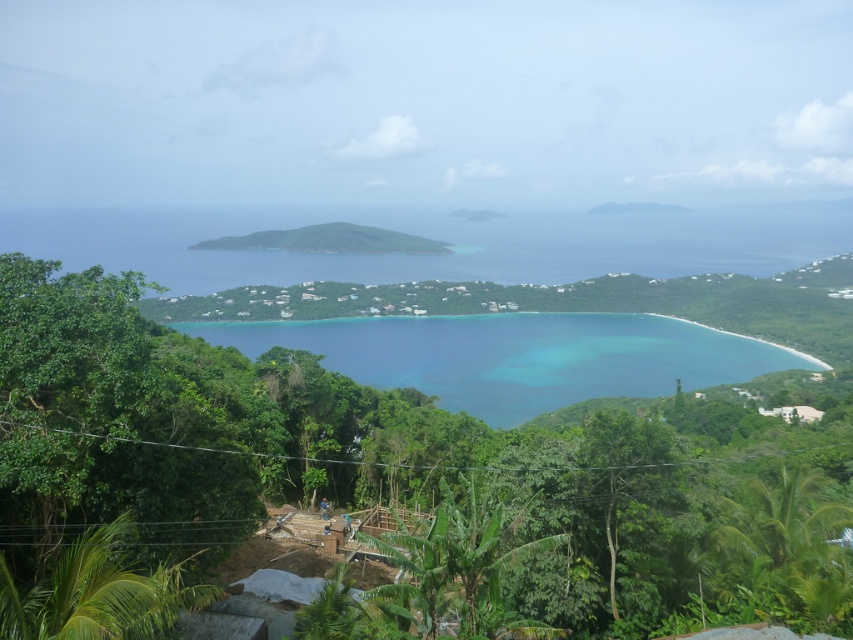
Which is above, green leafy trees at center or turquoise water at center?

Positioned higher is green leafy trees at center.

Does point (560, 467) come farther from viewer compared to point (462, 406)?

No, it is in front of (462, 406).

This screenshot has height=640, width=853. I want to click on green leafy trees at center, so click(415, 468).

Describe the element at coordinates (415, 468) in the screenshot. This screenshot has height=640, width=853. I see `green leafy trees at center` at that location.

Based on the photo, is green leafy trees at center wider than green leafy hill at center?

Correct, the width of green leafy trees at center exceeds that of green leafy hill at center.

Describe the element at coordinates (415, 468) in the screenshot. I see `green leafy trees at center` at that location.

At what (x,y) coordinates should I click in order to perform the action: click on green leafy trees at center. Please return your answer as a coordinate pair (x, y). The height and width of the screenshot is (640, 853). Looking at the image, I should click on (415, 468).

Which is above, turquoise water at center or green leafy hill at center?

green leafy hill at center is higher up.

Is turquoise water at center smaller than green leafy hill at center?

Incorrect, turquoise water at center is not smaller in size than green leafy hill at center.

From the picture: Who is more forward, (x=682, y=372) or (x=308, y=234)?

Point (x=682, y=372) is in front.

Identify the location of turquoise water at center. (515, 355).